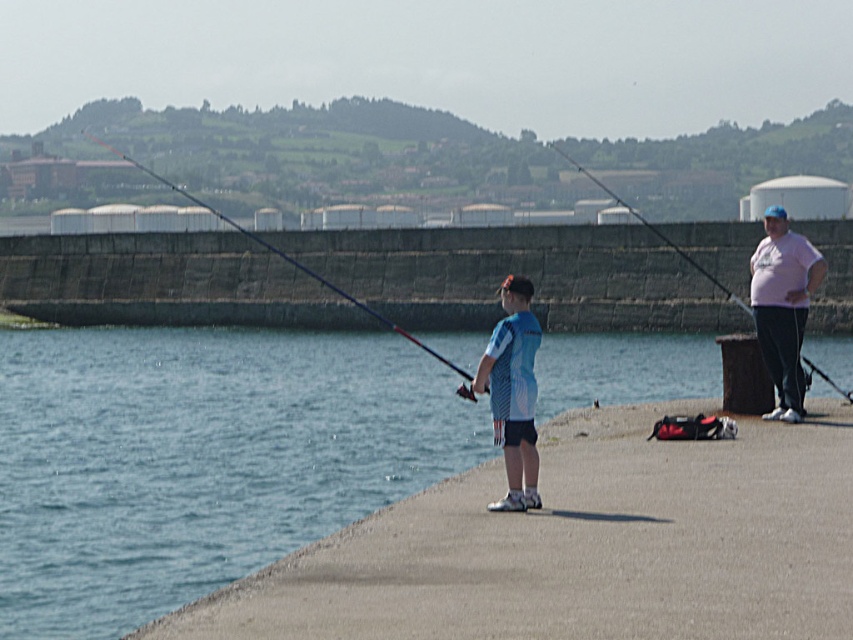
Question: Is blue matte shirt at center positioned at the back of pink cotton shirt at center?

Choices:
 (A) yes
 (B) no

Answer: (B)

Question: Among these objects, which one is nearest to the camera?

Choices:
 (A) matte blue fishing pole at center
 (B) matte black fishing pole at right
 (C) blue water at lower left

Answer: (C)

Question: Is matte blue fishing pole at center thinner than matte black fishing pole at right?

Choices:
 (A) yes
 (B) no

Answer: (B)

Question: Where is pink cotton shirt at center located in relation to matte blue fishing pole at center in the image?

Choices:
 (A) below
 (B) above

Answer: (A)

Question: Which object is closer to the camera taking this photo?

Choices:
 (A) blue water at lower left
 (B) matte black fishing pole at right

Answer: (A)

Question: Which object appears farthest from the camera in this image?

Choices:
 (A) matte black fishing pole at right
 (B) blue matte shirt at center
 (C) matte blue fishing pole at center
 (D) pink cotton shirt at center

Answer: (A)